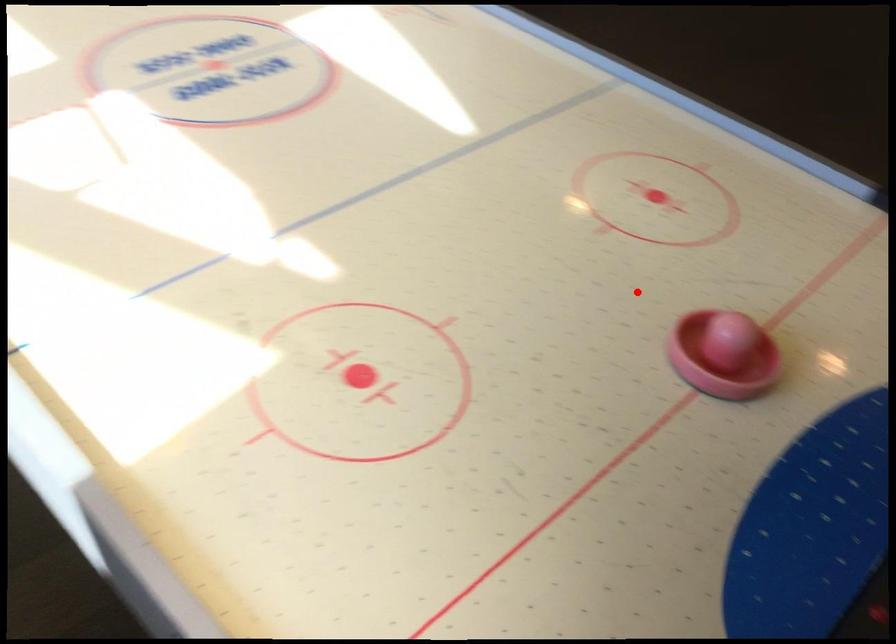
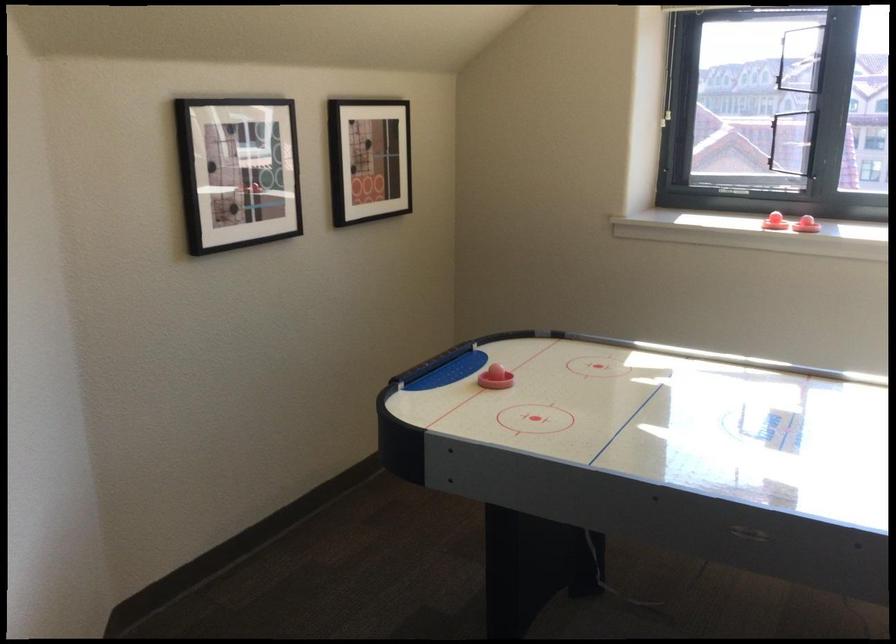
Question: A red point is marked in image1. In image2, is the corresponding 3D point closer to the camera or farther? Reply with the corresponding letter.

Choices:
 (A) The corresponding 3D point is closer.
 (B) The corresponding 3D point is farther.

Answer: (B)